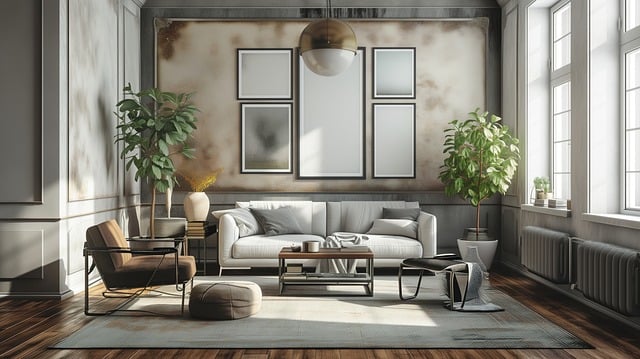
Where is `cushions`? The height and width of the screenshot is (359, 640). cushions is located at coordinates (244, 221), (278, 222), (390, 222), (399, 214).